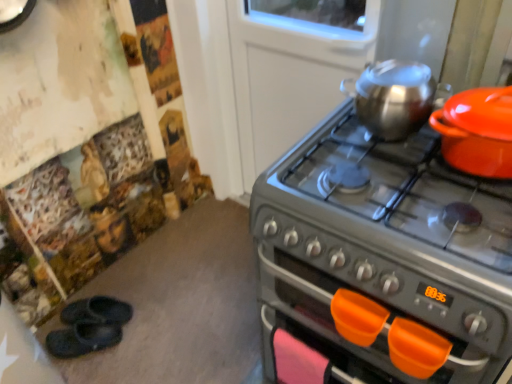
Question: Is orange plastic handle at lower center facing away from matte orange pot at right, the 1th kitchen appliance positioned from the right?

Choices:
 (A) yes
 (B) no

Answer: (B)

Question: Is orange plastic handle at lower center taller than matte orange pot at right, positioned as the 2th kitchen appliance in left-to-right order?

Choices:
 (A) no
 (B) yes

Answer: (A)

Question: Is orange plastic handle at lower center behind matte orange pot at right, positioned as the 2th kitchen appliance in left-to-right order?

Choices:
 (A) yes
 (B) no

Answer: (A)

Question: Considering the relative positions of orange plastic handle at lower center and matte orange pot at right, positioned as the 2th kitchen appliance in left-to-right order, in the image provided, is orange plastic handle at lower center in front of matte orange pot at right, positioned as the 2th kitchen appliance in left-to-right order,?

Choices:
 (A) no
 (B) yes

Answer: (A)

Question: Is orange plastic handle at lower center far away from matte orange pot at right, the 1th kitchen appliance positioned from the right?

Choices:
 (A) no
 (B) yes

Answer: (A)

Question: Is matte orange pot at right, positioned as the 2th kitchen appliance in left-to-right order, a part of orange plastic handle at lower center?

Choices:
 (A) yes
 (B) no

Answer: (B)

Question: Is matte orange pot at right, the 1th kitchen appliance positioned from the right, aimed at black rubber slippers at lower left, marked as the 1th footwear in a front-to-back arrangement?

Choices:
 (A) no
 (B) yes

Answer: (A)

Question: Is matte orange pot at right, positioned as the 2th kitchen appliance in left-to-right order, to the right of black rubber slippers at lower left, the second footwear in the back-to-front sequence, from the viewer's perspective?

Choices:
 (A) yes
 (B) no

Answer: (A)

Question: Is matte orange pot at right, positioned as the 2th kitchen appliance in left-to-right order, shorter than black rubber slippers at lower left, the second footwear in the back-to-front sequence?

Choices:
 (A) no
 (B) yes

Answer: (A)

Question: Is matte orange pot at right, the 1th kitchen appliance positioned from the right, to the left of black rubber slippers at lower left, marked as the 1th footwear in a front-to-back arrangement, from the viewer's perspective?

Choices:
 (A) yes
 (B) no

Answer: (B)

Question: Is matte orange pot at right, the 1th kitchen appliance positioned from the right, thinner than black rubber slippers at lower left, the second footwear in the back-to-front sequence?

Choices:
 (A) no
 (B) yes

Answer: (A)

Question: Is matte orange pot at right, the 1th kitchen appliance positioned from the right, not inside black rubber slippers at lower left, marked as the 1th footwear in a front-to-back arrangement?

Choices:
 (A) yes
 (B) no

Answer: (A)

Question: Considering the relative positions of shiny metallic kettle at upper right, positioned as the second kitchen appliance in right-to-left order, and black rubber slippers at lower left, marked as the 1th footwear in a front-to-back arrangement, in the image provided, is shiny metallic kettle at upper right, positioned as the second kitchen appliance in right-to-left order, in front of black rubber slippers at lower left, marked as the 1th footwear in a front-to-back arrangement,?

Choices:
 (A) no
 (B) yes

Answer: (B)